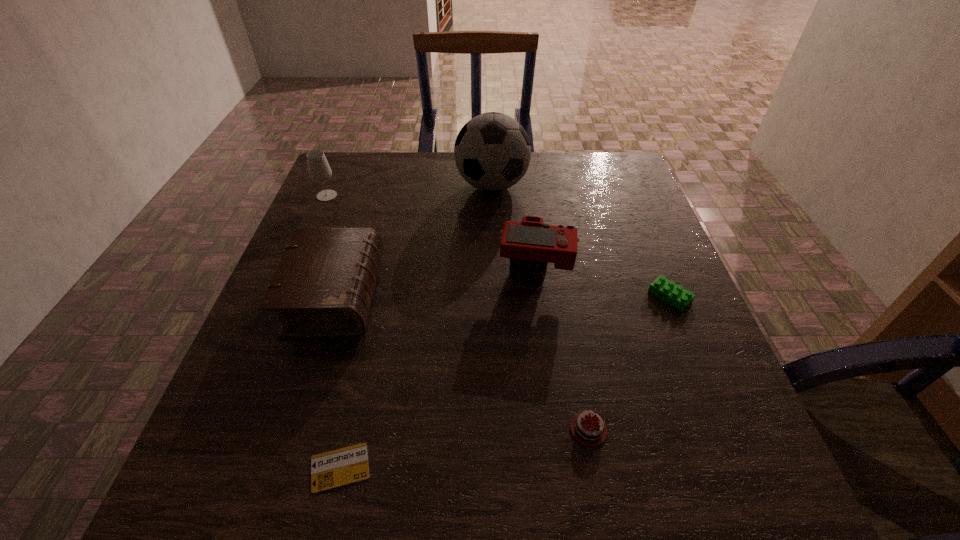
You are a GUI agent. You are given a task and a screenshot of the screen. Output one action in this format:
    pyautogui.click(x=<x>, y=<y>)
    Task: Click on the vacant point located between the Bible and the rightmost object
    
    Given the screenshot: What is the action you would take?
    pyautogui.click(x=502, y=296)

Find the location of a particular element. The height and width of the screenshot is (540, 960). free space between the identity card and the Bible is located at coordinates (337, 382).

Find the location of a particular element. The height and width of the screenshot is (540, 960). empty location between the camera and the Bible is located at coordinates (435, 285).

Find the location of a particular element. empty location between the glass and the Lego is located at coordinates (498, 246).

The height and width of the screenshot is (540, 960). What are the coordinates of `unoccupied area between the chocolate cake and the glass` in the screenshot? It's located at (458, 313).

In order to click on free point between the rightmost object and the glass in this screenshot , I will do `click(498, 246)`.

What are the coordinates of `blank region between the rightmost object and the camera` in the screenshot? It's located at (603, 285).

Point out which object is positioned as the third nearest to the chocolate cake. Please provide its 2D coordinates. Your answer should be formatted as a tuple, i.e. [(x, y)], where the tuple contains the x and y coordinates of a point satisfying the conditions above.

[(340, 467)]

Locate which object is the fifth closest to the camera. Please provide its 2D coordinates. Your answer should be formatted as a tuple, i.e. [(x, y)], where the tuple contains the x and y coordinates of a point satisfying the conditions above.

[(340, 467)]

I want to click on vacant space that satisfies the following two spatial constraints: 1. on the main logo of the camera; 2. on the left side of the soccer ball, so click(494, 273).